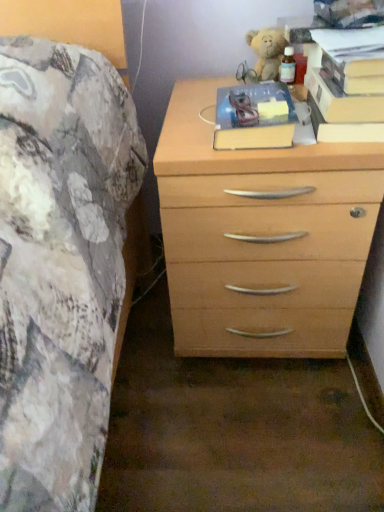
At what (x,y) coordinates should I click in order to perform the action: click on free space to the left of hardcover book at upper right, placed as the 2th paperback book when sorted from left to right. Please return your answer as a coordinate pair (x, y). The width and height of the screenshot is (384, 512). Looking at the image, I should click on (205, 117).